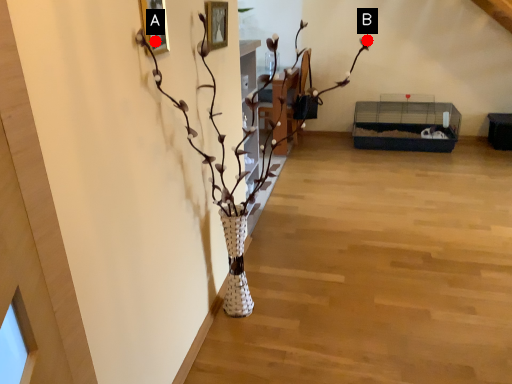
Question: Two points are circled on the image, labeled by A and B beside each circle. Which point is further to the camera?

Choices:
 (A) A is further
 (B) B is further

Answer: (B)